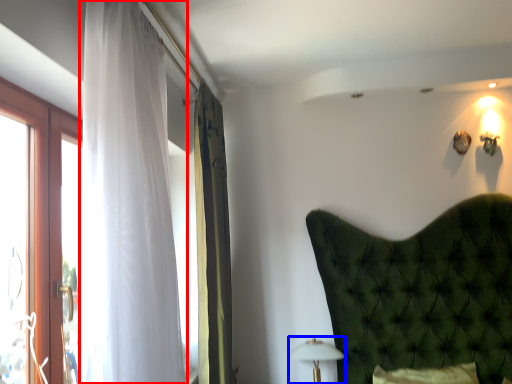
Question: Which object is closer to the camera taking this photo, curtain (highlighted by a red box) or table lamp (highlighted by a blue box)?

Choices:
 (A) curtain
 (B) table lamp

Answer: (A)